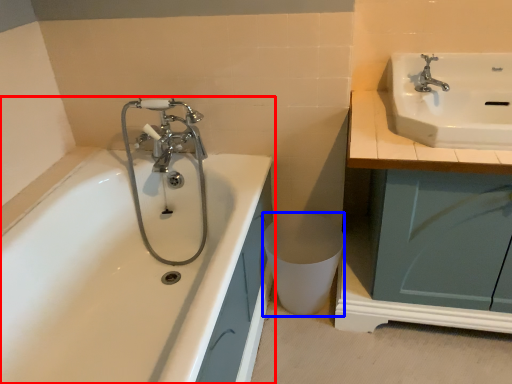
Question: Which point is closer to the camera, bathtub (highlighted by a red box) or toilet bowl (highlighted by a blue box)?

Choices:
 (A) bathtub
 (B) toilet bowl

Answer: (A)